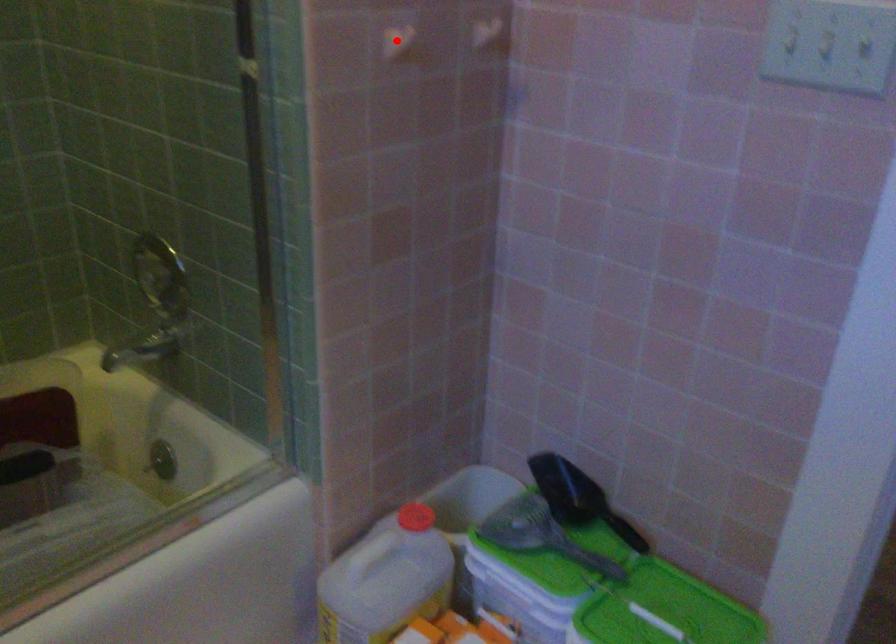
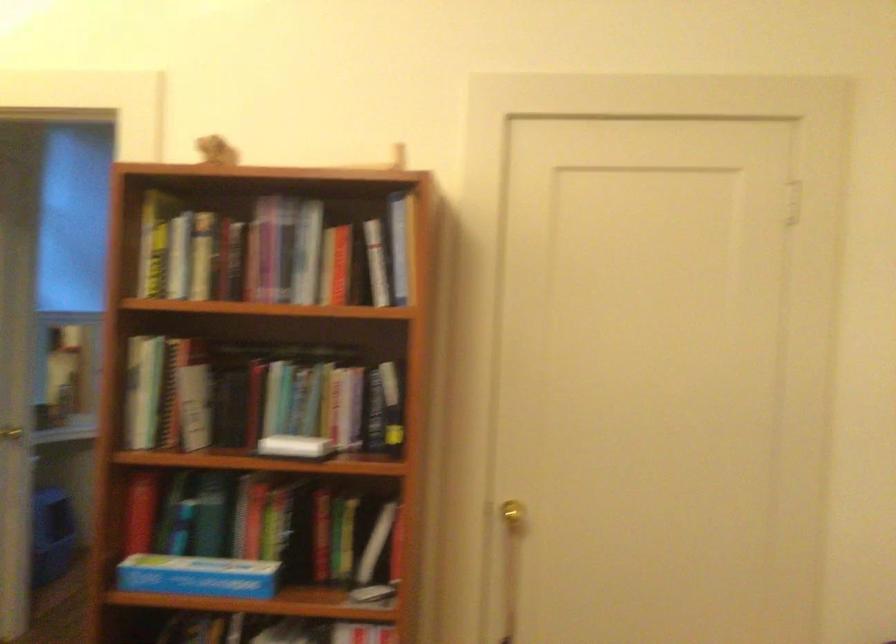
Question: I am providing you with two images of the same scene from different viewpoints. A red point is marked on the first image. At the location where the point appears in image 1, is it still visible in image 2?

Choices:
 (A) Yes
 (B) No

Answer: (B)